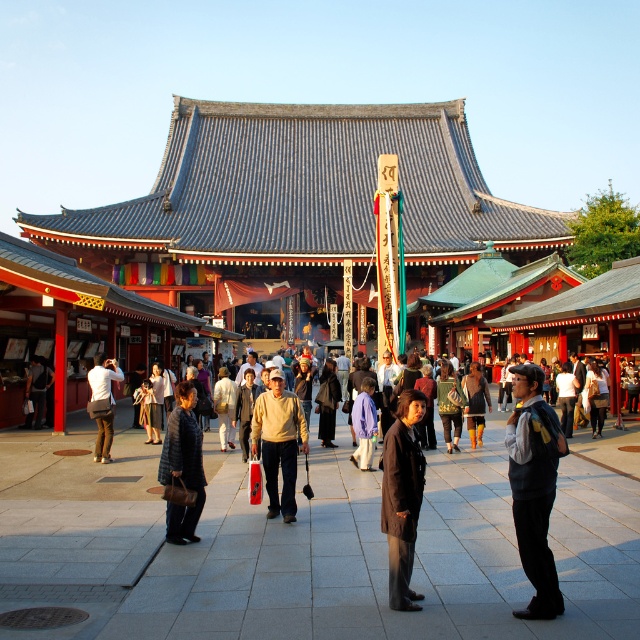
You are a photographer trying to capture a clear shot of the dark blue textured coat at center and the brown leather jacket at center. Since you want both subjects to be in focus, which one should you adjust your camera settings to prioritize focusing on first?

The dark blue textured coat at center occupies less space than the brown leather jacket at center, so you should prioritize focusing on the brown leather jacket at center first to ensure it is clear in the photo.

You are a photographer at the temple festival and want to capture both the light brown sweater at center and the brown leather jacket at center in a single photo. Which person should you focus on first to ensure both are in frame?

The light brown sweater at center is much taller than the brown leather jacket at center, so you should focus on the light brown sweater at center first to ensure both are in frame.